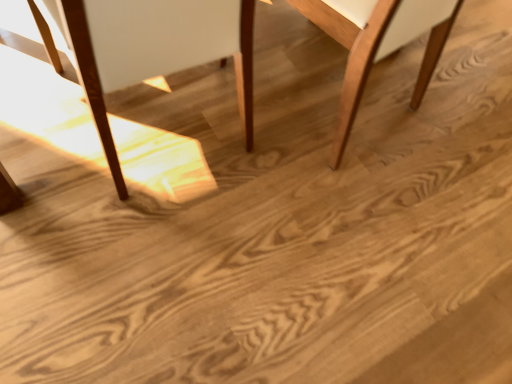
This screenshot has width=512, height=384. I want to click on matte wood chair at left, acting as the 2th chair starting from the right, so click(146, 48).

The width and height of the screenshot is (512, 384). Describe the element at coordinates (146, 48) in the screenshot. I see `matte wood chair at left, acting as the 2th chair starting from the right` at that location.

Image resolution: width=512 pixels, height=384 pixels. Identify the location of light brown wood chair at center, which is counted as the first chair, starting from the right. (377, 48).

What do you see at coordinates (377, 48) in the screenshot? I see `light brown wood chair at center, which is counted as the first chair, starting from the right` at bounding box center [377, 48].

At what (x,y) coordinates should I click in order to perform the action: click on matte wood chair at left, placed as the 1th chair when sorted from left to right. Please return your answer as a coordinate pair (x, y). The width and height of the screenshot is (512, 384). Looking at the image, I should click on (146, 48).

Considering the positions of objects matte wood chair at left, placed as the 1th chair when sorted from left to right, and light brown wood chair at center, the 2th chair from the left, in the image provided, who is more to the left, matte wood chair at left, placed as the 1th chair when sorted from left to right, or light brown wood chair at center, the 2th chair from the left,?

Positioned to the left is matte wood chair at left, placed as the 1th chair when sorted from left to right.

In the image, is matte wood chair at left, acting as the 2th chair starting from the right, positioned in front of or behind light brown wood chair at center, the 2th chair from the left?

Clearly, matte wood chair at left, acting as the 2th chair starting from the right, is in front of light brown wood chair at center, the 2th chair from the left.

Does point (156, 43) lie behind point (344, 87)?

That is False.

From the image's perspective, who appears lower, matte wood chair at left, placed as the 1th chair when sorted from left to right, or light brown wood chair at center, which is counted as the first chair, starting from the right?

matte wood chair at left, placed as the 1th chair when sorted from left to right, is shown below in the image.

From a real-world perspective, is matte wood chair at left, placed as the 1th chair when sorted from left to right, above or below light brown wood chair at center, the 2th chair from the left?

From a real-world perspective, matte wood chair at left, placed as the 1th chair when sorted from left to right, is physically above light brown wood chair at center, the 2th chair from the left.

Can you confirm if matte wood chair at left, placed as the 1th chair when sorted from left to right, is thinner than light brown wood chair at center, the 2th chair from the left?

In fact, matte wood chair at left, placed as the 1th chair when sorted from left to right, might be wider than light brown wood chair at center, the 2th chair from the left.

In the scene shown: Does matte wood chair at left, acting as the 2th chair starting from the right, have a lesser height compared to light brown wood chair at center, which is counted as the first chair, starting from the right?

No, matte wood chair at left, acting as the 2th chair starting from the right, is not shorter than light brown wood chair at center, which is counted as the first chair, starting from the right.

Considering the relative sizes of matte wood chair at left, placed as the 1th chair when sorted from left to right, and light brown wood chair at center, which is counted as the first chair, starting from the right, in the image provided, is matte wood chair at left, placed as the 1th chair when sorted from left to right, bigger than light brown wood chair at center, which is counted as the first chair, starting from the right,?

Yes, matte wood chair at left, placed as the 1th chair when sorted from left to right, is bigger than light brown wood chair at center, which is counted as the first chair, starting from the right.

Would you say matte wood chair at left, acting as the 2th chair starting from the right, is inside or outside light brown wood chair at center, the 2th chair from the left?

matte wood chair at left, acting as the 2th chair starting from the right, is not inside light brown wood chair at center, the 2th chair from the left, it's outside.

Are matte wood chair at left, acting as the 2th chair starting from the right, and light brown wood chair at center, the 2th chair from the left, located far from each other?

No, there isn't a large distance between matte wood chair at left, acting as the 2th chair starting from the right, and light brown wood chair at center, the 2th chair from the left.

Is matte wood chair at left, acting as the 2th chair starting from the right, looking in the opposite direction of light brown wood chair at center, the 2th chair from the left?

matte wood chair at left, acting as the 2th chair starting from the right, is not turned away from light brown wood chair at center, the 2th chair from the left.

Can you tell me how much matte wood chair at left, acting as the 2th chair starting from the right, and light brown wood chair at center, which is counted as the first chair, starting from the right, differ in facing direction?

12.9 degrees separate the facing orientations of matte wood chair at left, acting as the 2th chair starting from the right, and light brown wood chair at center, which is counted as the first chair, starting from the right.

Could you measure the distance between matte wood chair at left, placed as the 1th chair when sorted from left to right, and light brown wood chair at center, which is counted as the first chair, starting from the right?

matte wood chair at left, placed as the 1th chair when sorted from left to right, and light brown wood chair at center, which is counted as the first chair, starting from the right, are 13.81 inches apart.

I want to click on chair located behind the matte wood chair at left, acting as the 2th chair starting from the right, so click(377, 48).

Which object is positioned more to the left, light brown wood chair at center, which is counted as the first chair, starting from the right, or matte wood chair at left, placed as the 1th chair when sorted from left to right?

matte wood chair at left, placed as the 1th chair when sorted from left to right, is more to the left.

Considering the positions of objects light brown wood chair at center, the 2th chair from the left, and matte wood chair at left, placed as the 1th chair when sorted from left to right, in the image provided, who is in front, light brown wood chair at center, the 2th chair from the left, or matte wood chair at left, placed as the 1th chair when sorted from left to right,?

matte wood chair at left, placed as the 1th chair when sorted from left to right, is more forward.

Does point (348, 32) appear closer or farther from the camera than point (219, 29)?

Point (348, 32) is positioned farther from the camera compared to point (219, 29).

Based on the photo, from the image's perspective, which is below, light brown wood chair at center, which is counted as the first chair, starting from the right, or matte wood chair at left, placed as the 1th chair when sorted from left to right?

matte wood chair at left, placed as the 1th chair when sorted from left to right, appears lower in the image.

From a real-world perspective, relative to matte wood chair at left, acting as the 2th chair starting from the right, is light brown wood chair at center, which is counted as the first chair, starting from the right, vertically above or below?

Clearly, from a real-world perspective, light brown wood chair at center, which is counted as the first chair, starting from the right, is below matte wood chair at left, acting as the 2th chair starting from the right.

Does light brown wood chair at center, the 2th chair from the left, have a greater width compared to matte wood chair at left, acting as the 2th chair starting from the right?

No.

Does light brown wood chair at center, which is counted as the first chair, starting from the right, have a greater height compared to matte wood chair at left, acting as the 2th chair starting from the right?

Incorrect, the height of light brown wood chair at center, which is counted as the first chair, starting from the right, is not larger of that of matte wood chair at left, acting as the 2th chair starting from the right.

Who is bigger, light brown wood chair at center, which is counted as the first chair, starting from the right, or matte wood chair at left, acting as the 2th chair starting from the right?

matte wood chair at left, acting as the 2th chair starting from the right, is bigger.

Is matte wood chair at left, acting as the 2th chair starting from the right, a part of light brown wood chair at center, the 2th chair from the left?

No, matte wood chair at left, acting as the 2th chair starting from the right, is not surrounded by light brown wood chair at center, the 2th chair from the left.

Is light brown wood chair at center, the 2th chair from the left, with matte wood chair at left, acting as the 2th chair starting from the right?

No, light brown wood chair at center, the 2th chair from the left, is not next to matte wood chair at left, acting as the 2th chair starting from the right.

Is light brown wood chair at center, which is counted as the first chair, starting from the right, looking in the opposite direction of matte wood chair at left, acting as the 2th chair starting from the right?

That's not correct — light brown wood chair at center, which is counted as the first chair, starting from the right, is not looking away from matte wood chair at left, acting as the 2th chair starting from the right.

How many degrees apart are the facing directions of light brown wood chair at center, which is counted as the first chair, starting from the right, and matte wood chair at left, placed as the 1th chair when sorted from left to right?

They differ by 12.9 degrees in their facing directions.

The width and height of the screenshot is (512, 384). Identify the location of chair that appears behind the matte wood chair at left, acting as the 2th chair starting from the right. tap(377, 48).

Identify the location of chair above the light brown wood chair at center, which is counted as the first chair, starting from the right (from a real-world perspective). (146, 48).

Where is `chair below the light brown wood chair at center, the 2th chair from the left (from the image's perspective)`? chair below the light brown wood chair at center, the 2th chair from the left (from the image's perspective) is located at coordinates (146, 48).